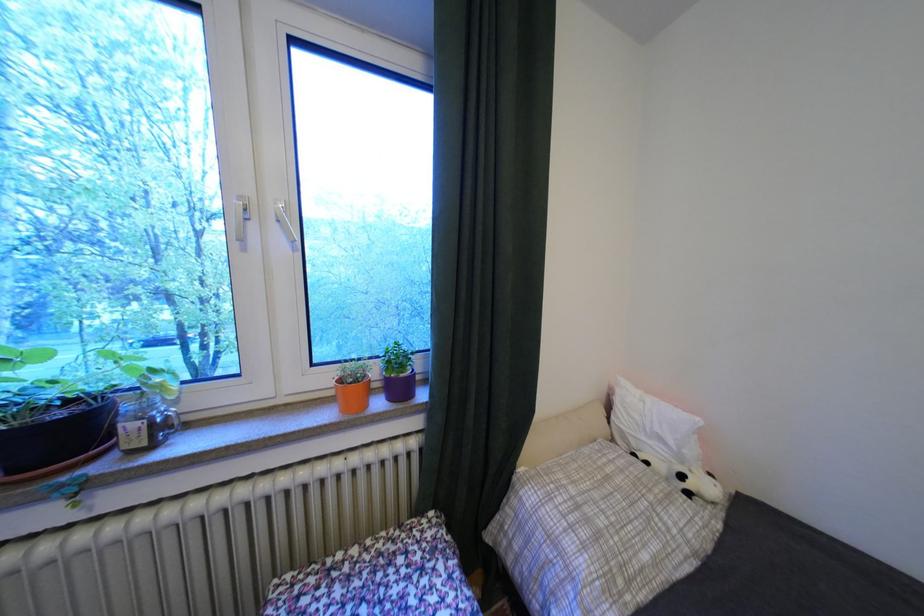
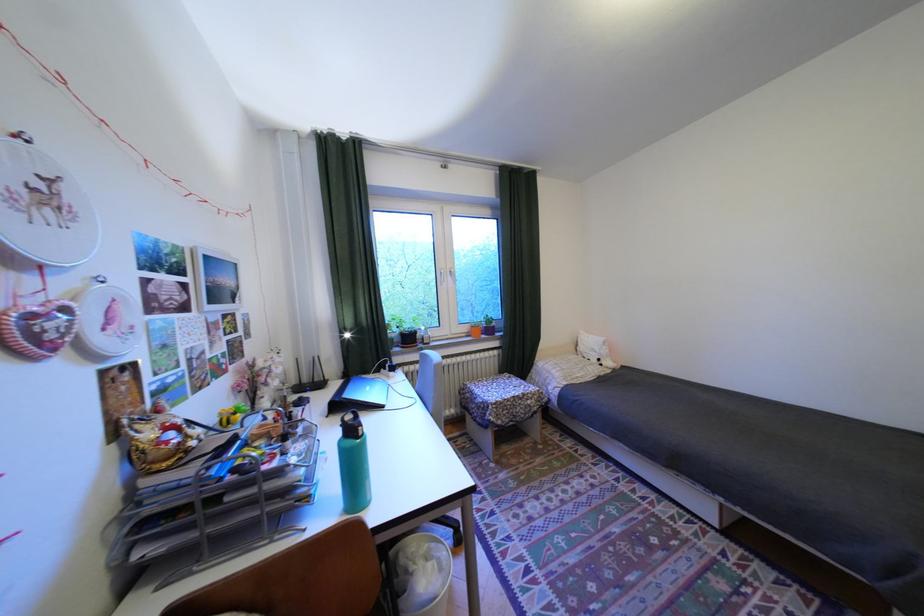
Where in the second image is the point corresponding to the point at 256,249 from the first image?

(454, 285)